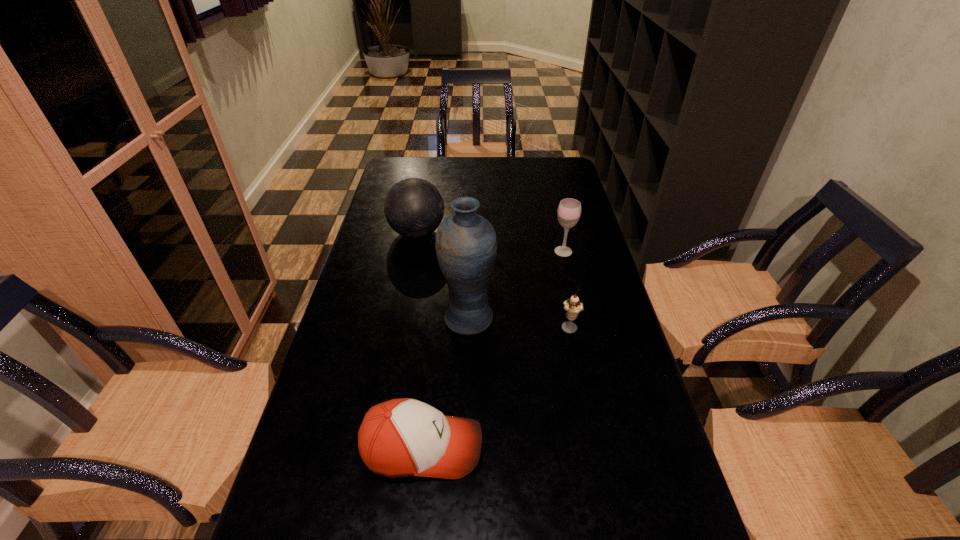
Where is `bowling ball present at the left edge`? Image resolution: width=960 pixels, height=540 pixels. bowling ball present at the left edge is located at coordinates (413, 207).

At what (x,y) coordinates should I click in order to perform the action: click on baseball cap located at the left edge. Please return your answer as a coordinate pair (x, y). This screenshot has width=960, height=540. Looking at the image, I should click on (405, 437).

You are a GUI agent. You are given a task and a screenshot of the screen. Output one action in this format:
    pyautogui.click(x=<x>, y=<y>)
    Task: Click on the wineglass located at the right edge
    The width and height of the screenshot is (960, 540).
    Given the screenshot: What is the action you would take?
    pyautogui.click(x=569, y=210)

At what (x,y) coordinates should I click in order to perform the action: click on icecream located at the right edge. Please return your answer as a coordinate pair (x, y). This screenshot has width=960, height=540. Looking at the image, I should click on (573, 306).

Locate an element on the screen. blank space at the far edge of the desktop is located at coordinates 522,166.

In order to click on vacant space at the left edge in this screenshot , I will do `click(318, 410)`.

In order to click on free point at the far left corner in this screenshot , I will do `click(420, 171)`.

Where is `free space between the wineglass and the tallest object`? free space between the wineglass and the tallest object is located at coordinates (516, 285).

Identify the location of free space between the icecream and the nearest object. The height and width of the screenshot is (540, 960). (496, 388).

Where is `free space that is in between the wineglass and the icecream`? This screenshot has width=960, height=540. free space that is in between the wineglass and the icecream is located at coordinates (566, 291).